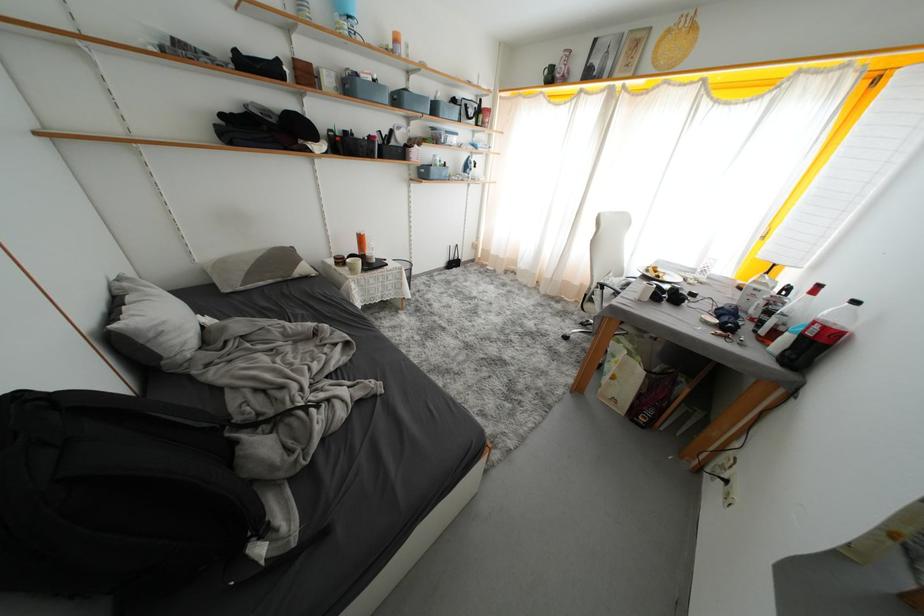
What are the coordinates of `white plate` in the screenshot? It's located at (659, 274).